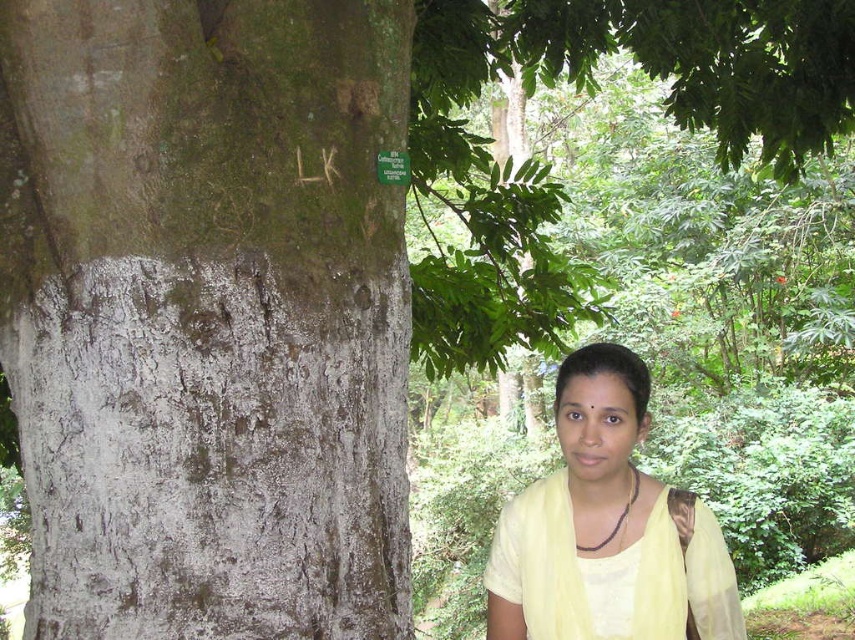
Is green rough bark at left smaller than yellow sheer fabric at lower right?

No.

Is green rough bark at left taller than yellow sheer fabric at lower right?

Indeed, green rough bark at left has a greater height compared to yellow sheer fabric at lower right.

What do you see at coordinates (207, 314) in the screenshot? The height and width of the screenshot is (640, 855). I see `green rough bark at left` at bounding box center [207, 314].

This screenshot has height=640, width=855. I want to click on green rough bark at left, so click(x=207, y=314).